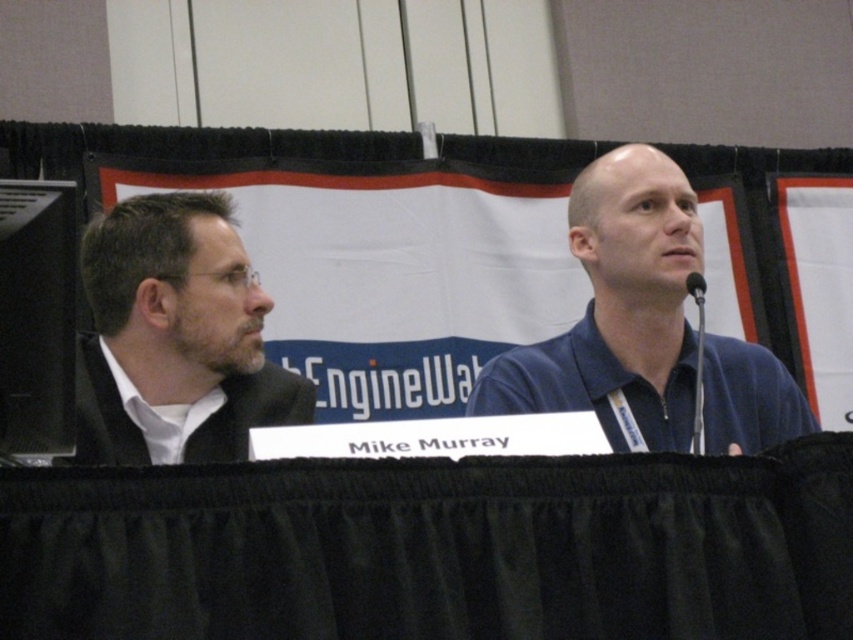
Between blue zip-up shirt at center and black plastic microphone at upper right, which one has less height?

With less height is black plastic microphone at upper right.

Describe the element at coordinates (618, 310) in the screenshot. I see `blue zip-up shirt at center` at that location.

Between point (585, 406) and point (704, 289), which one is positioned behind?

Point (585, 406)

Where is `blue zip-up shirt at center`? blue zip-up shirt at center is located at coordinates (618, 310).

Measure the distance between matte black jacket at left and black plastic microphone at upper right.

matte black jacket at left and black plastic microphone at upper right are 4.02 meters apart from each other.

Does matte black jacket at left appear under black plastic microphone at upper right?

Yes.

The image size is (853, 640). What do you see at coordinates (175, 337) in the screenshot?
I see `matte black jacket at left` at bounding box center [175, 337].

The height and width of the screenshot is (640, 853). I want to click on matte black jacket at left, so click(x=175, y=337).

Does blue zip-up shirt at center have a greater width compared to matte black jacket at left?

Yes, blue zip-up shirt at center is wider than matte black jacket at left.

Which of these two, blue zip-up shirt at center or matte black jacket at left, stands taller?

blue zip-up shirt at center

Does point (677, 256) lie behind point (117, 240)?

Yes, it is.

At what (x,y) coordinates should I click in order to perform the action: click on blue zip-up shirt at center. Please return your answer as a coordinate pair (x, y). Looking at the image, I should click on (618, 310).